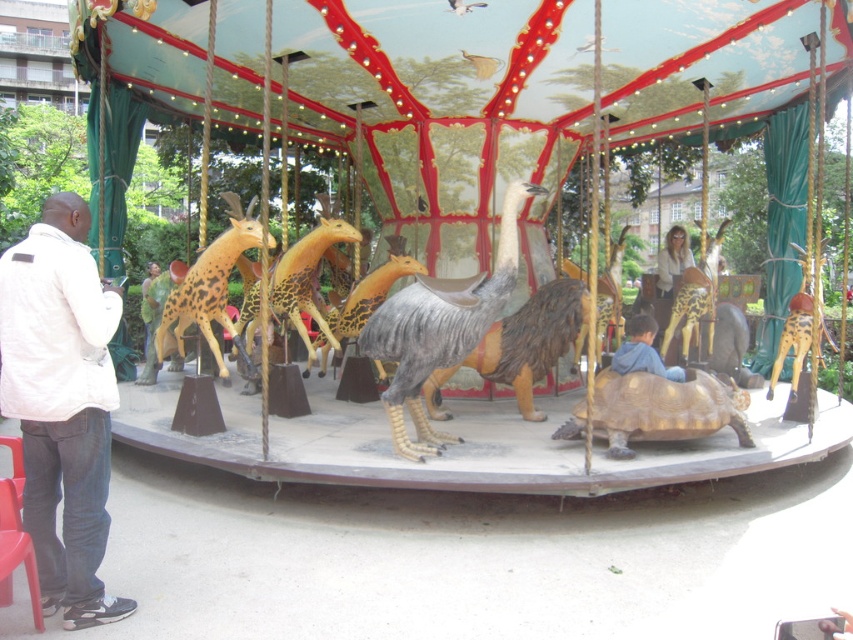
You are standing at the center of the carousel and looking towards the direction of the greenery in the background. There are two points marked on the carousel floor at coordinates point (659, 259) and point (142, 317). Which point is closer to you?

Point (659, 259) is in front of point (142, 317), so it is closer to you.

You are a parent trying to choose a seat for your child on the carousel. You see the brown textured tortoise at center and the golden metallic tortoise at center. Which tortoise would you choose if you want a bigger seat?

The golden metallic tortoise at center is larger in size compared to the brown textured tortoise at center, so it would provide a bigger seat for the child.